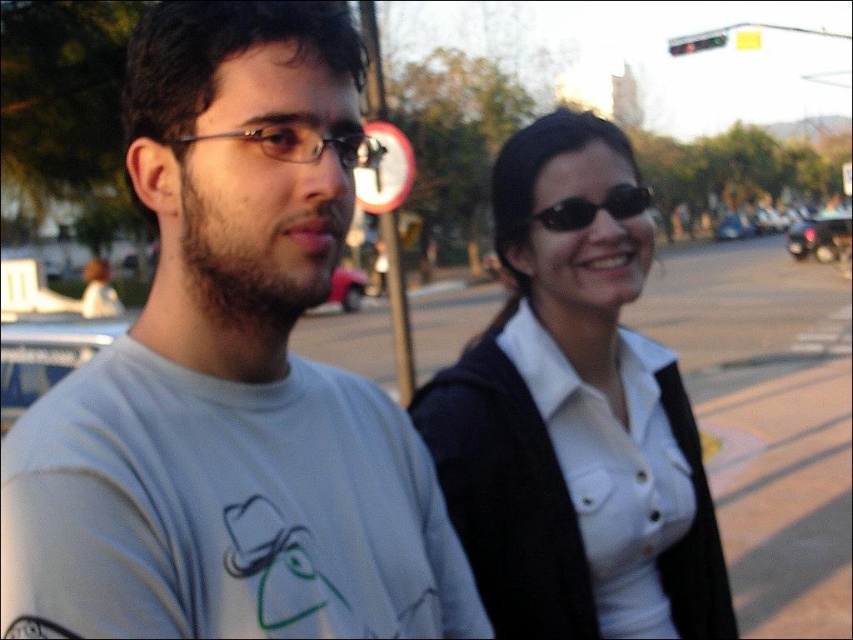
Who is taller, white matte t-shirt at left or black reflective sunglasses at upper right?

Standing taller between the two is white matte t-shirt at left.

Between point (177, 321) and point (585, 211), which one is positioned in front?

Positioned in front is point (177, 321).

Identify the location of white matte t-shirt at left. (229, 384).

The width and height of the screenshot is (853, 640). I want to click on white matte t-shirt at left, so click(x=229, y=384).

Does white matte shirt at center come behind clear plastic glasses at left?

A: That is False.

Can you confirm if white matte shirt at center is positioned above clear plastic glasses at left?

No.

Does point (577, 132) lie behind point (345, 157)?

Yes, it is behind point (345, 157).

Find the location of a particular element. The height and width of the screenshot is (640, 853). white matte shirt at center is located at coordinates (564, 410).

You are a GUI agent. You are given a task and a screenshot of the screen. Output one action in this format:
    pyautogui.click(x=<x>, y=<y>)
    Task: Click on the white matte shirt at center
    
    Given the screenshot: What is the action you would take?
    pyautogui.click(x=564, y=410)

In the scene shown: Between white matte shirt at center and black reflective sunglasses at upper right, which one has less height?

Standing shorter between the two is black reflective sunglasses at upper right.

At what (x,y) coordinates should I click in order to perform the action: click on white matte shirt at center. Please return your answer as a coordinate pair (x, y). The height and width of the screenshot is (640, 853). Looking at the image, I should click on (564, 410).

You are a GUI agent. You are given a task and a screenshot of the screen. Output one action in this format:
    pyautogui.click(x=<x>, y=<y>)
    Task: Click on the white matte shirt at center
    The height and width of the screenshot is (640, 853).
    Given the screenshot: What is the action you would take?
    pyautogui.click(x=564, y=410)